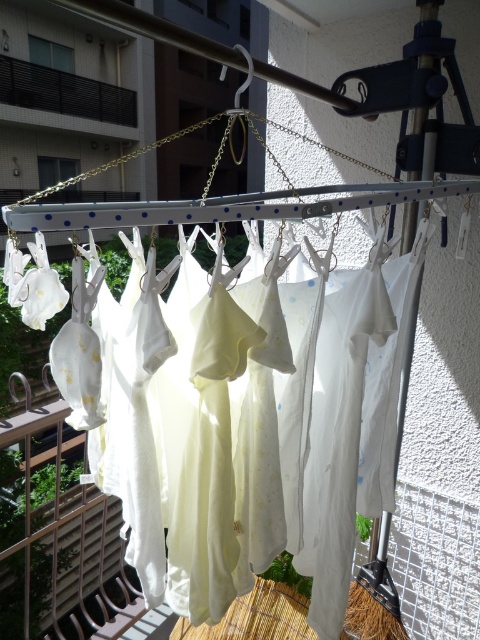
You are a parent trying to ensure your baby clothes are safe from falling off the balcony. You see the white cotton shirts at center and the black metal railing at upper left. Which object is closer to the edge of the balcony?

The white cotton shirts at center are below the black metal railing at upper left, so they are closer to the edge of the balcony than the railing.

You are a delivery drone carrying a package that needs to be placed between the white cotton shirts at center and the black metal railing at upper left. The package requires 1.5 meters of space to land. Can you safely land between them?

The distance between the white cotton shirts at center and the black metal railing at upper left is 17.38 meters, which is more than enough space for the drone to land safely as it only requires 1.5 meters.